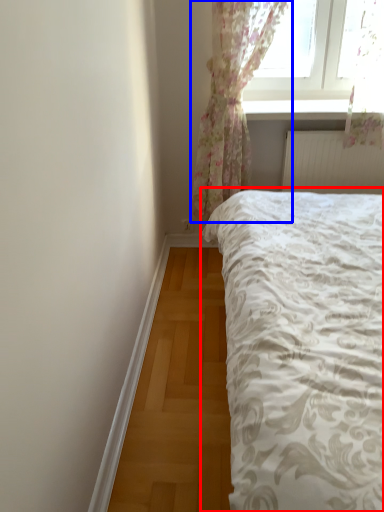
Question: Which of the following is the farthest to the observer, bed (highlighted by a red box) or curtain (highlighted by a blue box)?

Choices:
 (A) bed
 (B) curtain

Answer: (B)